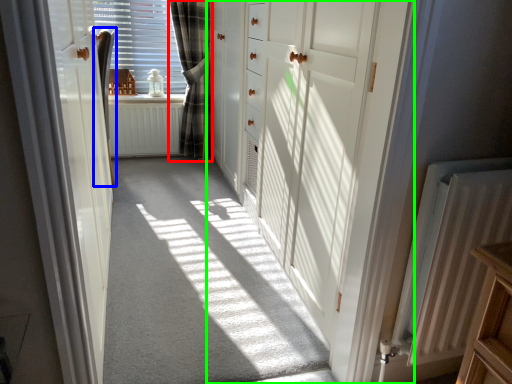
Question: Considering the real-world distances, which object is farthest from curtain (highlighted by a red box)? curtain (highlighted by a blue box) or door (highlighted by a green box)?

Choices:
 (A) curtain
 (B) door

Answer: (B)